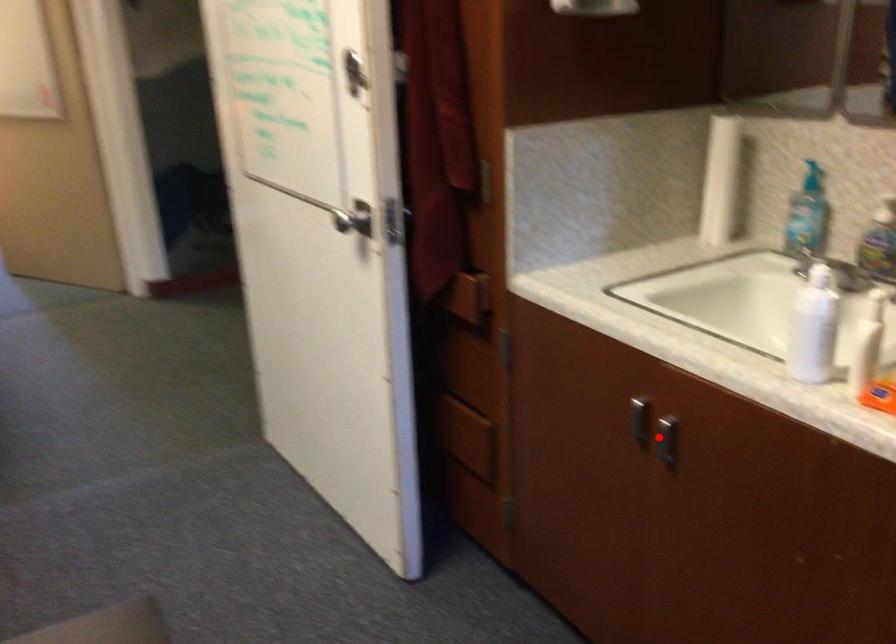
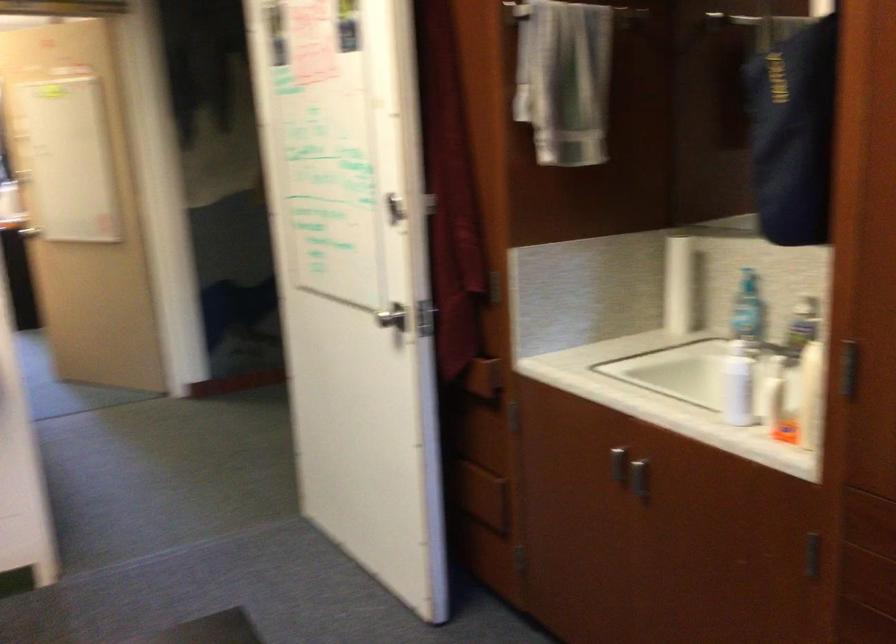
Question: I am providing you with two images of the same scene from different viewpoints. A red point is shown in image1. For the corresponding object point in image2, is it positioned nearer or farther from the camera?

Choices:
 (A) Nearer
 (B) Farther

Answer: (B)